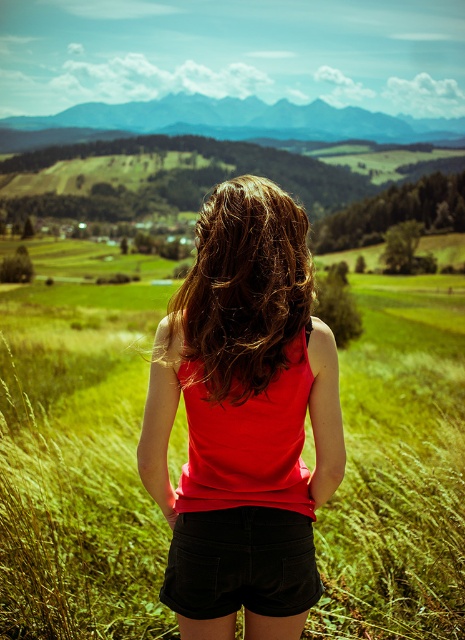
Between point (243, 317) and point (250, 589), which one is positioned behind?

Positioned behind is point (250, 589).

How far apart are matte red tank top at center and black denim shorts at center?

They are 24.02 centimeters apart.

Locate an element on the screen. This screenshot has width=465, height=640. matte red tank top at center is located at coordinates (244, 419).

Is shiny brown hair at center positioned behind black denim shorts at center?

No, it is not.

The width and height of the screenshot is (465, 640). What do you see at coordinates (244, 289) in the screenshot? I see `shiny brown hair at center` at bounding box center [244, 289].

In order to click on shiny brown hair at center in this screenshot , I will do click(244, 289).

Find the location of `shiny brown hair at center`. shiny brown hair at center is located at coordinates (244, 289).

Does matte red tank top at center have a larger size compared to shiny brown hair at center?

Indeed, matte red tank top at center has a larger size compared to shiny brown hair at center.

The width and height of the screenshot is (465, 640). Find the location of `matte red tank top at center`. matte red tank top at center is located at coordinates (244, 419).

The image size is (465, 640). Find the location of `matte red tank top at center`. matte red tank top at center is located at coordinates (244, 419).